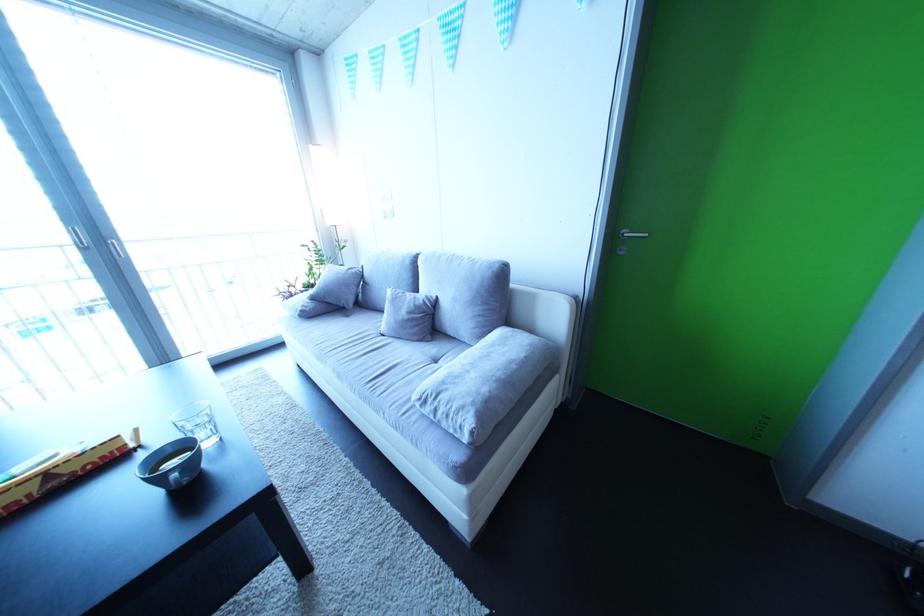
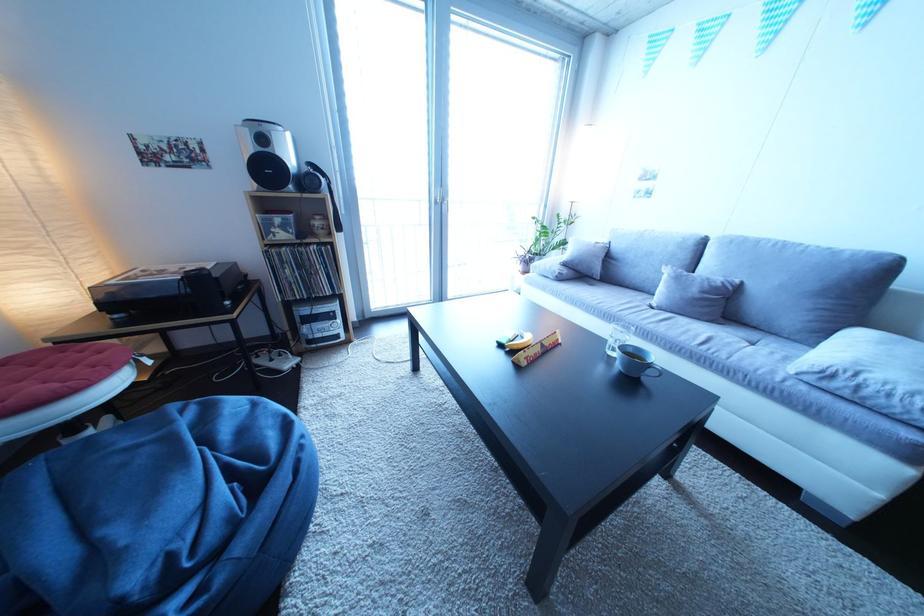
The point at (447, 302) is marked in the first image. Where is the corresponding point in the second image?

(750, 286)